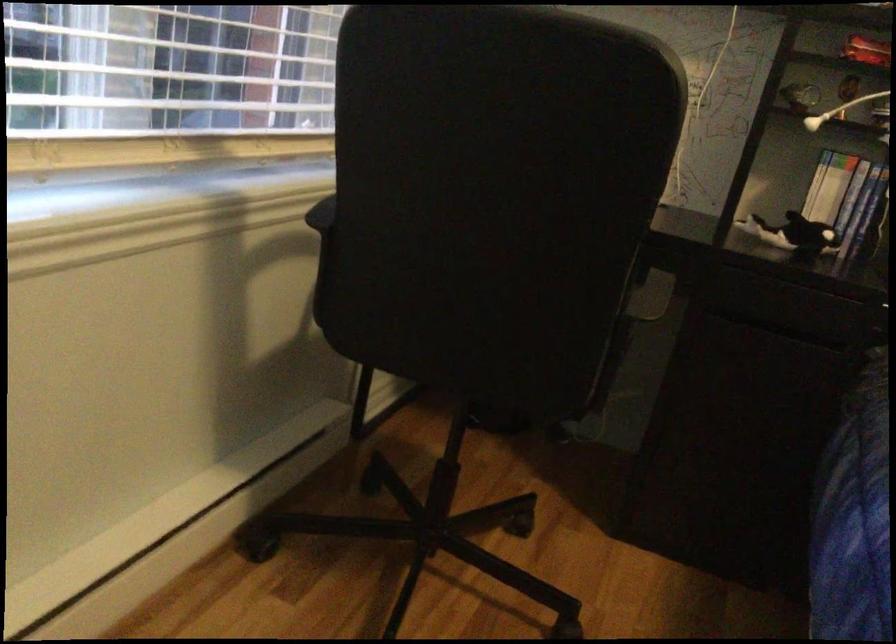
Image resolution: width=896 pixels, height=644 pixels. Identify the location of black chair armrest. (321, 214).